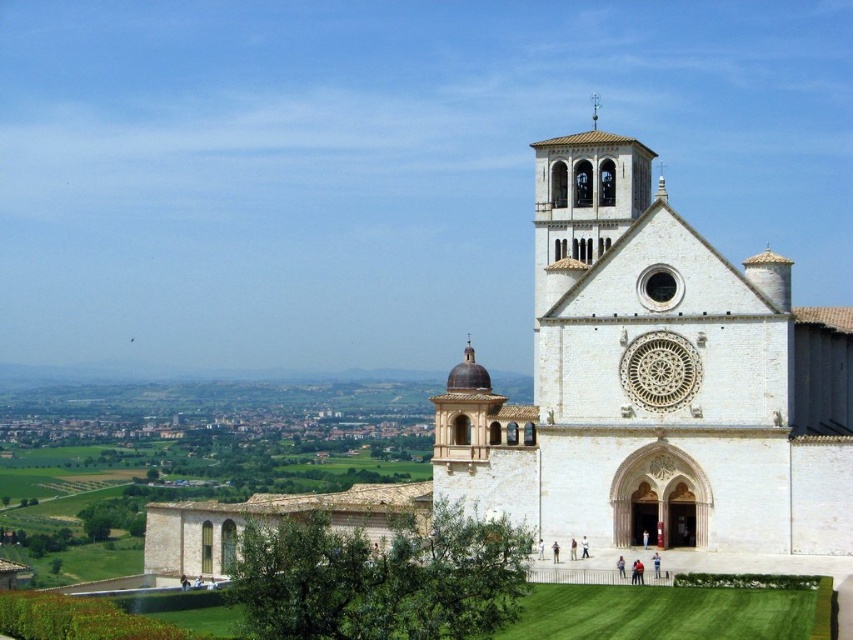
You are standing at the base of the hill where the white stone church at right and the polished silver spire at upper center are visible. Which object is closer to your viewpoint?

The white stone church at right is positioned under the polished silver spire at upper center, meaning the church is closer to your viewpoint than the spire.

You are a tourist standing at the base of the hill, looking up at the white stone church at right and the polished silver spire at upper center. Which object is closer to the left edge of your view?

The white stone church at right is positioned on the left side of polished silver spire at upper center, so it is closer to the left edge of your view.

You are standing at the center of the image and want to walk towards the white stone church at right. In which general direction should you head?

Since the white stone church at right is located at point (x=656, y=380), you should head towards the right direction from the center to reach it.